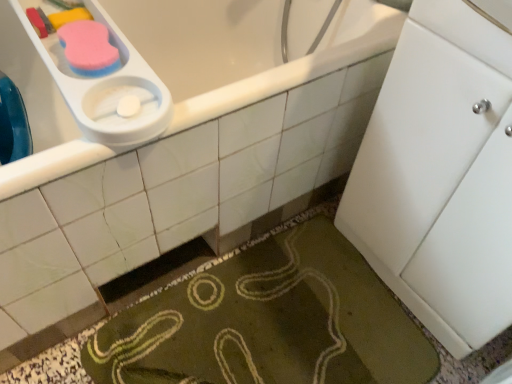
This screenshot has height=384, width=512. In order to click on vacant location below green textured bath mat at lower center (from a real-world perspective) in this screenshot , I will do `click(281, 325)`.